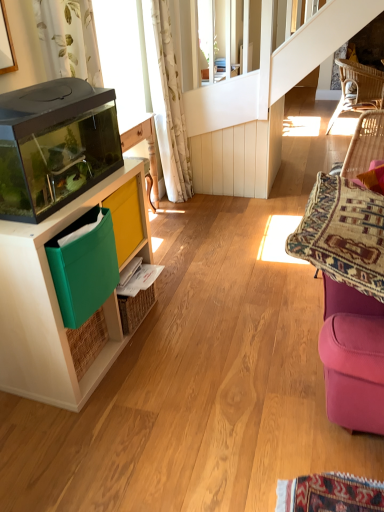
What do you see at coordinates (56, 303) in the screenshot?
I see `matte wood cabinet at left` at bounding box center [56, 303].

Measure the distance between point (126,228) and camera.

They are 6.34 feet apart.

Where is `green plastic bin at left`? The height and width of the screenshot is (512, 384). green plastic bin at left is located at coordinates (126, 218).

Measure the distance between point (13, 146) and camera.

The depth of point (13, 146) is 1.26 meters.

Locate an element on the screen. matte wood cabinet at left is located at coordinates tap(56, 303).

Considering the points (168, 13) and (383, 145), which point is behind, point (168, 13) or point (383, 145)?

Positioned behind is point (168, 13).

Is white floral fabric curtain at upper left thinner than velvet purple swivel chair at right?

Yes.

How far apart are white floral fabric curtain at upper left and velvet purple swivel chair at right?

white floral fabric curtain at upper left is 7.20 feet from velvet purple swivel chair at right.

From the image's perspective, which object appears higher, white floral fabric curtain at upper left or velvet purple swivel chair at right?

white floral fabric curtain at upper left appears higher in the image.

From the picture: Is velvet purple swivel chair at right touching green plastic bin at left?

velvet purple swivel chair at right and green plastic bin at left are clearly separated.

Which of these two, velvet purple swivel chair at right or green plastic bin at left, is wider?

velvet purple swivel chair at right is wider.

Is velvet purple swivel chair at right shorter than green plastic bin at left?

In fact, velvet purple swivel chair at right may be taller than green plastic bin at left.

This screenshot has width=384, height=512. I want to click on swivel chair below the green plastic bin at left (from the image's perspective), so click(353, 358).

Based on their positions, is woven rattan chair at upper right located to the left or right of velvet purple swivel chair at right?

Based on their positions, woven rattan chair at upper right is located to the right of velvet purple swivel chair at right.

Measure the distance from woven rattan chair at upper right to velvet purple swivel chair at right.

A distance of 2.97 meters exists between woven rattan chair at upper right and velvet purple swivel chair at right.

Considering the relative sizes of woven rattan chair at upper right and velvet purple swivel chair at right in the image provided, is woven rattan chair at upper right smaller than velvet purple swivel chair at right?

Actually, woven rattan chair at upper right might be larger than velvet purple swivel chair at right.

Is woven rattan chair at upper right facing away from velvet purple swivel chair at right?

woven rattan chair at upper right does not have its back to velvet purple swivel chair at right.

Looking at this image, are woven rattan chair at upper right and transparent glass aquarium at left making contact?

No, woven rattan chair at upper right is not in contact with transparent glass aquarium at left.

Consider the image. How many degrees apart are the facing directions of woven rattan chair at upper right and transparent glass aquarium at left?

They differ by 3.27 degrees in their facing directions.

From a real-world perspective, is woven rattan chair at upper right on top of transparent glass aquarium at left?

No.

Does transparent glass aquarium at left have a larger size compared to white floral fabric curtain at upper left?

Incorrect, transparent glass aquarium at left is not larger than white floral fabric curtain at upper left.

Who is more distant, transparent glass aquarium at left or white floral fabric curtain at upper left?

white floral fabric curtain at upper left is further from the camera.

From the image's perspective, relative to white floral fabric curtain at upper left, is transparent glass aquarium at left above or below?

Based on their image positions, transparent glass aquarium at left is located beneath white floral fabric curtain at upper left.

Could you tell me if transparent glass aquarium at left is facing white floral fabric curtain at upper left?

No, transparent glass aquarium at left is not aimed at white floral fabric curtain at upper left.

Which is more to the right, transparent glass aquarium at left or velvet purple swivel chair at right?

velvet purple swivel chair at right.

Does point (35, 133) come in front of point (328, 308)?

Yes, it is in front of point (328, 308).

Based on the photo, considering the relative sizes of transparent glass aquarium at left and velvet purple swivel chair at right in the image provided, is transparent glass aquarium at left wider than velvet purple swivel chair at right?

Yes.

Does transparent glass aquarium at left come in front of velvet purple swivel chair at right?

No, it is not.

From the picture: Are transparent glass aquarium at left and green plastic bin at left making contact?

transparent glass aquarium at left is not next to green plastic bin at left, and they're not touching.

Is transparent glass aquarium at left oriented away from green plastic bin at left?

That's not correct — transparent glass aquarium at left is not looking away from green plastic bin at left.

Considering the points (49, 167) and (134, 228), which point is in front, point (49, 167) or point (134, 228)?

The point (49, 167) is in front.

Is transparent glass aquarium at left positioned before green plastic bin at left?

Yes, transparent glass aquarium at left is in front of green plastic bin at left.

In the image, there is a white floral fabric curtain at upper left. Where is `swivel chair below it (from a real-world perspective)`? This screenshot has height=512, width=384. swivel chair below it (from a real-world perspective) is located at coordinates (353, 358).

Where is `swivel chair in front of the green plastic bin at left`? swivel chair in front of the green plastic bin at left is located at coordinates (353, 358).

Estimate the real-world distances between objects in this image. Which object is closer to matte wood cabinet at left, velvet purple swivel chair at right or woven rattan chair at upper right?

Based on the image, velvet purple swivel chair at right appears to be nearer to matte wood cabinet at left.

Which object lies nearer to the anchor point green plastic bin at left, woven rattan chair at upper right or white floral fabric curtain at upper left?

white floral fabric curtain at upper left is closer to green plastic bin at left.

Estimate the real-world distances between objects in this image. Which object is closer to woven rattan chair at upper right, matte wood cabinet at left or green plastic bin at left?

green plastic bin at left.

Which object lies further to the anchor point white floral fabric curtain at upper left, green plastic bin at left or matte wood cabinet at left?

matte wood cabinet at left is further to white floral fabric curtain at upper left.

Looking at the image, which one is located closer to matte wood cabinet at left, transparent glass aquarium at left or velvet purple swivel chair at right?

transparent glass aquarium at left is closer to matte wood cabinet at left.

Looking at the image, which one is located closer to woven rattan chair at upper right, white floral fabric curtain at upper left or matte wood cabinet at left?

white floral fabric curtain at upper left lies closer to woven rattan chair at upper right than the other object.

Based on the photo, when comparing their distances from white floral fabric curtain at upper left, does matte wood cabinet at left or woven rattan chair at upper right seem closer?

woven rattan chair at upper right is closer to white floral fabric curtain at upper left.

Estimate the real-world distances between objects in this image. Which object is further from green plastic bin at left, white floral fabric curtain at upper left or matte wood cabinet at left?

white floral fabric curtain at upper left.

Find the location of `shelf between transparent glass aquarium at left and white floral fabric curtain at upper left from front to back`. shelf between transparent glass aquarium at left and white floral fabric curtain at upper left from front to back is located at coordinates (126, 218).

Identify the location of cabinetry located between transparent glass aquarium at left and green plastic bin at left in the depth direction. The image size is (384, 512). (56, 303).

This screenshot has height=512, width=384. I want to click on appliance between velvet purple swivel chair at right and white floral fabric curtain at upper left from front to back, so click(55, 146).

Where is `cabinetry between velvet purple swivel chair at right and white floral fabric curtain at upper left from front to back`? The image size is (384, 512). cabinetry between velvet purple swivel chair at right and white floral fabric curtain at upper left from front to back is located at coordinates (56, 303).